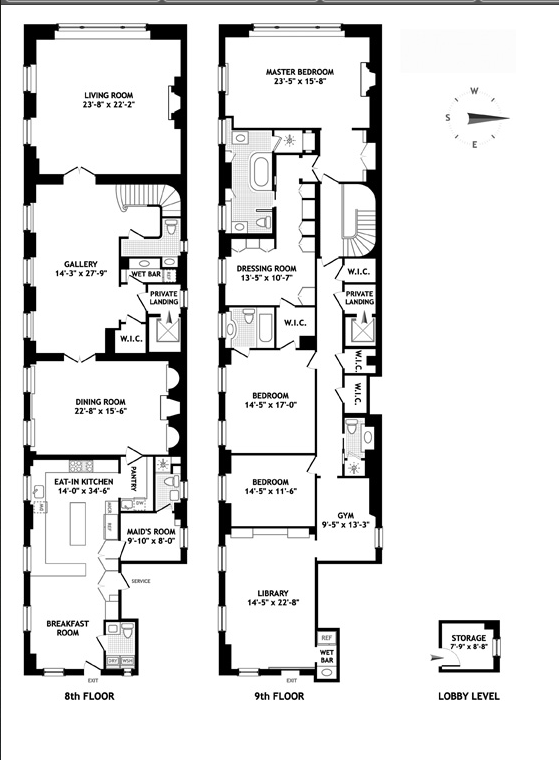
Where is `closet`? The image size is (559, 760). closet is located at coordinates (134, 339), (367, 397), (356, 366), (361, 270), (297, 321).